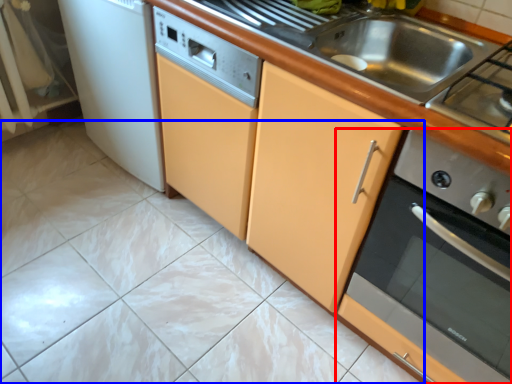
Question: Which object is closer to the camera taking this photo, home appliance (highlighted by a red box) or ceramic tile (highlighted by a blue box)?

Choices:
 (A) home appliance
 (B) ceramic tile

Answer: (A)